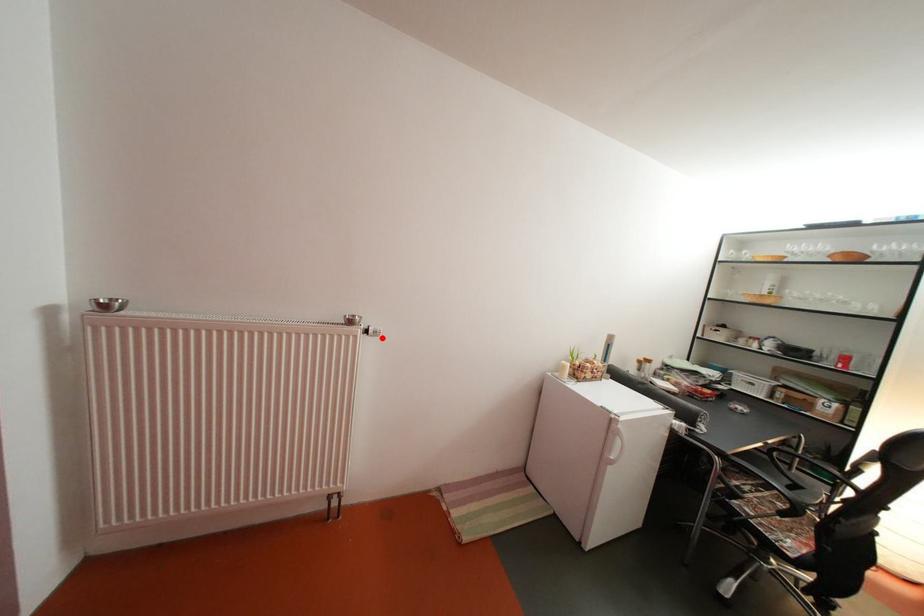
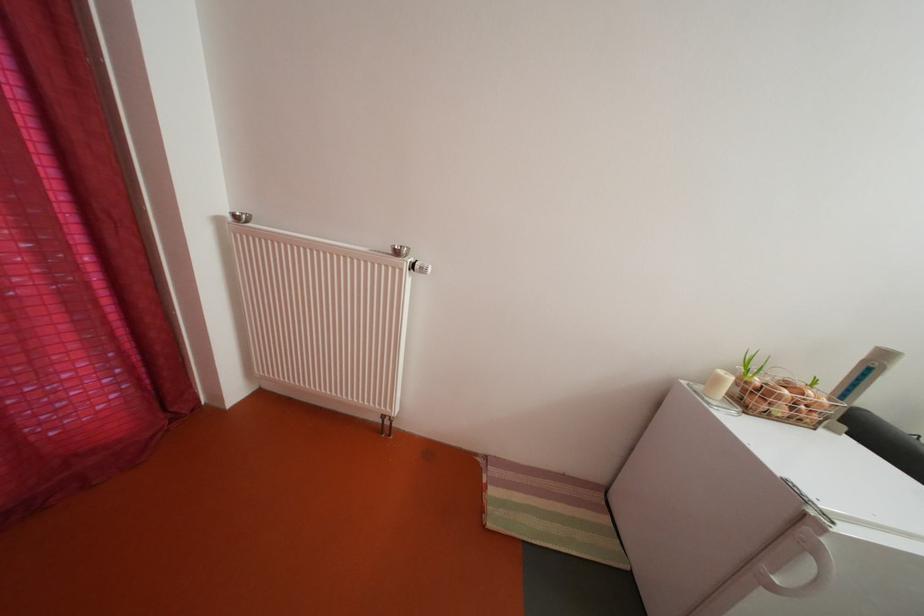
Where in the second image is the point corresponding to the highlighted location from the first image?

(429, 273)